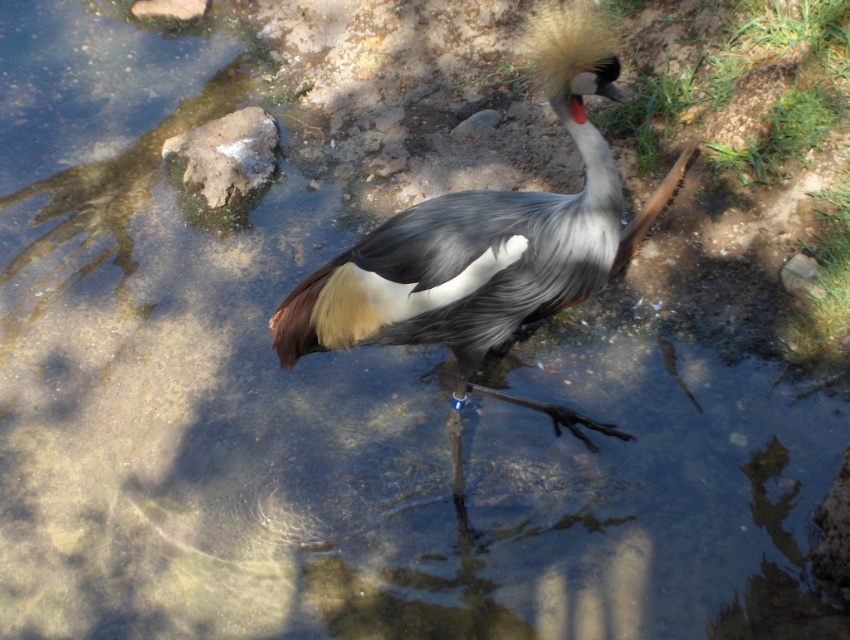
Question: Can you confirm if gray feathered bird at center is smaller than gray rock at lower right?

Choices:
 (A) no
 (B) yes

Answer: (A)

Question: Which point is farther from the camera taking this photo?

Choices:
 (A) (471, 252)
 (B) (816, 260)
 (C) (180, 4)
 (D) (214, 141)

Answer: (C)

Question: Which of the following is the closest to the observer?

Choices:
 (A) (789, 259)
 (B) (361, 305)

Answer: (B)

Question: Is gray rock at lower right to the right of smooth beige rock at upper left from the viewer's perspective?

Choices:
 (A) yes
 (B) no

Answer: (A)

Question: Which of the following is the farthest from the observer?

Choices:
 (A) (188, 1)
 (B) (785, 268)
 (C) (224, 163)
 (D) (496, 321)

Answer: (A)

Question: Is smooth gray rock at upper left bigger than smooth beige rock at upper left?

Choices:
 (A) no
 (B) yes

Answer: (B)